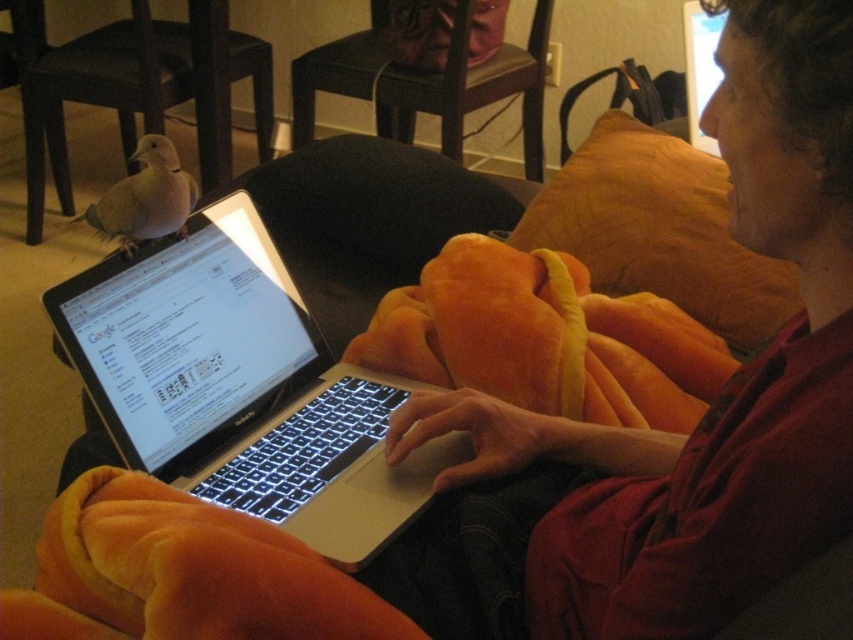
Can you confirm if orange plush pillow at upper right is shorter than brown feathered bird at lower left?

Incorrect, orange plush pillow at upper right's height does not fall short of brown feathered bird at lower left's.

Does point (590, 221) come behind point (165, 204)?

Yes, point (590, 221) is farther from viewer.

Which is in front, point (730, 342) or point (143, 236)?

Point (143, 236) is more forward.

At what (x,y) coordinates should I click in order to perform the action: click on orange plush pillow at upper right. Please return your answer as a coordinate pair (x, y). The width and height of the screenshot is (853, 640). Looking at the image, I should click on (659, 228).

Can you confirm if silver metallic laptop at center is positioned to the right of orange plush pillow at upper right?

Incorrect, silver metallic laptop at center is not on the right side of orange plush pillow at upper right.

Can you confirm if silver metallic laptop at center is shorter than orange plush pillow at upper right?

Yes, silver metallic laptop at center is shorter than orange plush pillow at upper right.

Is point (137, 461) closer to viewer compared to point (599, 237)?

Yes, it is.

Locate an element on the screen. This screenshot has width=853, height=640. silver metallic laptop at center is located at coordinates (241, 387).

Which of these two, silver metallic laptop at center or brown feathered bird at lower left, stands taller?

silver metallic laptop at center is taller.

How distant is silver metallic laptop at center from brown feathered bird at lower left?

The distance of silver metallic laptop at center from brown feathered bird at lower left is 8.72 inches.

The width and height of the screenshot is (853, 640). What are the coordinates of `silver metallic laptop at center` in the screenshot? It's located at (241, 387).